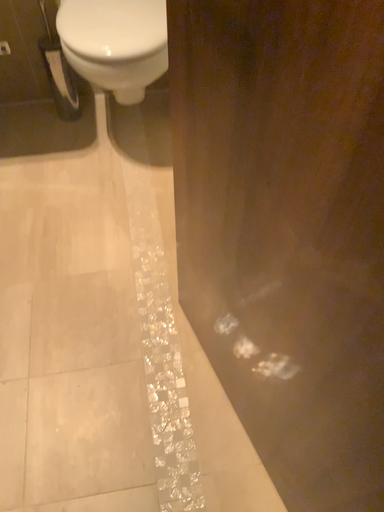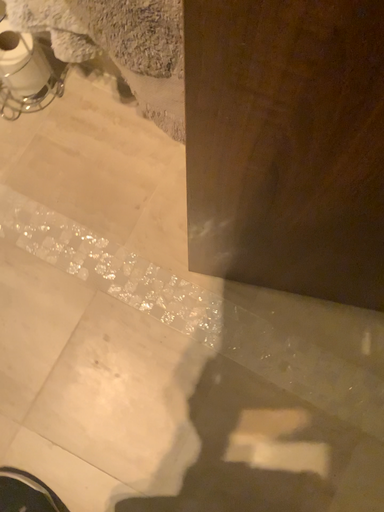
Question: Which way did the camera rotate in the video?

Choices:
 (A) rotated upward
 (B) rotated downward

Answer: (B)